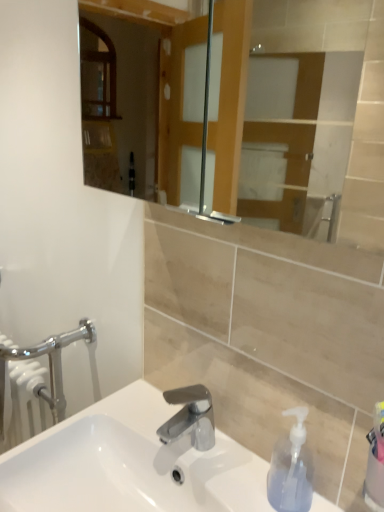
Question: Considering the relative positions of white glossy sink at center and transparent plastic soap dispenser at lower right in the image provided, is white glossy sink at center to the left or to the right of transparent plastic soap dispenser at lower right?

Choices:
 (A) left
 (B) right

Answer: (A)

Question: From the image's perspective, is white glossy sink at center located above or below transparent plastic soap dispenser at lower right?

Choices:
 (A) below
 (B) above

Answer: (A)

Question: Which object is the closest to the chrome metallic faucet at center?

Choices:
 (A) transparent plastic soap dispenser at lower right
 (B) white glossy sink at center

Answer: (B)

Question: Which object is positioned farthest from the white glossy sink at center?

Choices:
 (A) transparent plastic soap dispenser at lower right
 (B) chrome metallic faucet at center

Answer: (A)